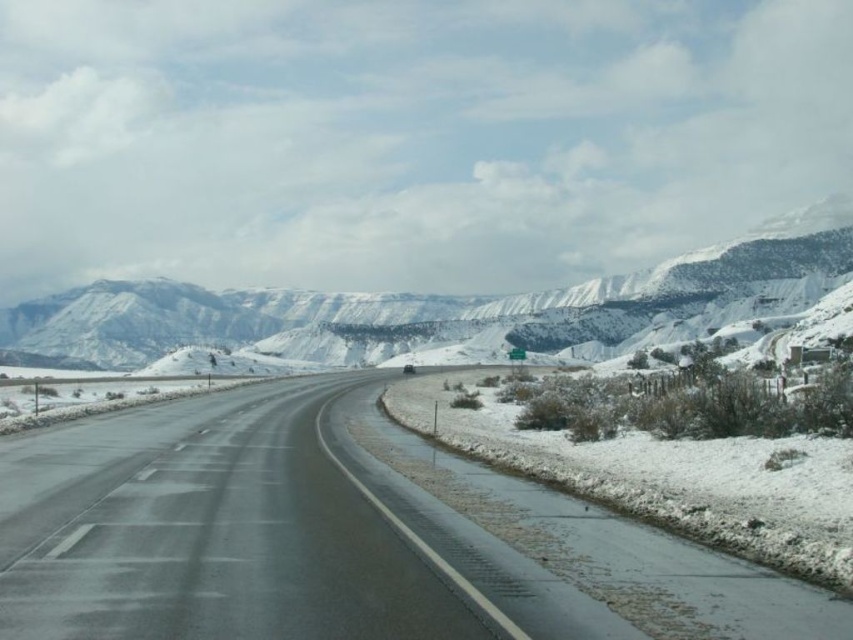
Consider the image. You are a driver approaching the black asphalt highway at center and the snowy rocky mountain at upper center. Which object will appear larger in your view as you drive forward?

The black asphalt highway at center will appear larger in your view because it is closer to the viewer than the snowy rocky mountain at upper center.

You are a driver approaching the black asphalt highway at center and the snowy rocky mountain at upper center. Which object is closer to the horizon?

The snowy rocky mountain at upper center is closer to the horizon because it is positioned above the black asphalt highway at center, which is lower in the scene.

You are driving a car and see two points on the road ahead. The first point is at coordinates point (680,566) and the second point is at point (656,324). Which point is closer to your current position?

Point (656,324) is closer to your current position because it is behind point (680,566), which is further ahead on the road.